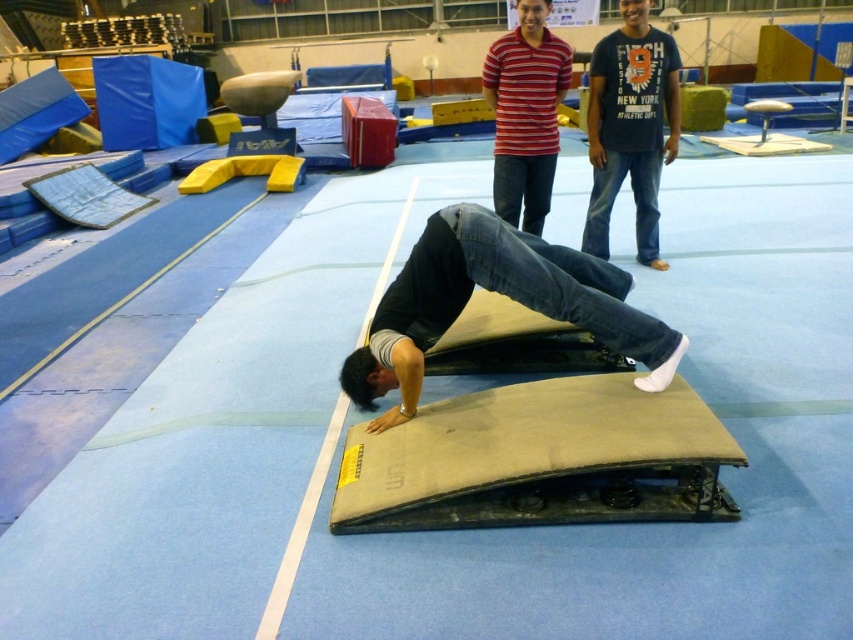
You are navigating a gymnastics facility and need to locate the denim jeans at center. According to the coordinates provided, where exactly would you find them in the image?

The denim jeans at center is located at point coordinates of 0.459 on the x axis and 0.586 on the y axis.

You are a photographer setting up a wide shot in the gym. The denim jeans at center and striped cotton shirt at upper center are in your frame. Which object should you adjust your focus on if you want to capture the wider subject?

You should focus on the denim jeans at center because it might be wider than the striped cotton shirt at upper center according to the description.

You are standing in the gym and see the point at coordinates (498, 292). What object is located at that point?

The point at coordinates (498, 292) indicates denim jeans at center.